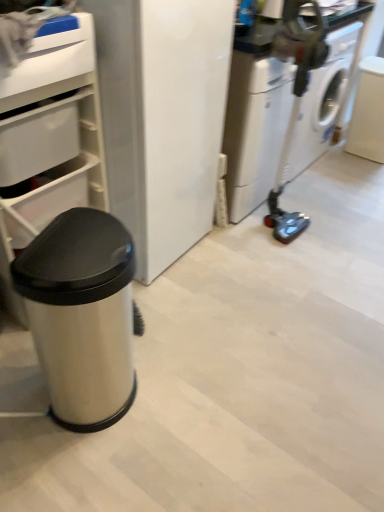
Question: Does white plastic drawer at upper left, positioned as the first drawer in top-to-bottom order, have a lesser height compared to white glossy washing machine at right?

Choices:
 (A) no
 (B) yes

Answer: (B)

Question: Is white plastic drawer at upper left, the second drawer from the bottom, to the left of white glossy washing machine at right from the viewer's perspective?

Choices:
 (A) no
 (B) yes

Answer: (B)

Question: Is white glossy washing machine at right completely or partially inside white plastic drawer at upper left, the second drawer from the bottom?

Choices:
 (A) no
 (B) yes

Answer: (A)

Question: Is white plastic drawer at upper left, the second drawer from the bottom, located outside white glossy washing machine at right?

Choices:
 (A) no
 (B) yes

Answer: (B)

Question: Is white plastic drawer at upper left, positioned as the first drawer in top-to-bottom order, bigger than white glossy washing machine at right?

Choices:
 (A) yes
 (B) no

Answer: (B)

Question: Considering the positions of white plastic drawer at upper left, which is counted as the second drawer, starting from the top, and white glossy washing machine at right in the image, is white plastic drawer at upper left, which is counted as the second drawer, starting from the top, taller or shorter than white glossy washing machine at right?

Choices:
 (A) short
 (B) tall

Answer: (A)

Question: Is white plastic drawer at upper left, which is the first drawer from bottom to top, spatially inside white glossy washing machine at right, or outside of it?

Choices:
 (A) outside
 (B) inside

Answer: (A)

Question: In terms of width, does white plastic drawer at upper left, which is counted as the second drawer, starting from the top, look wider or thinner when compared to white glossy washing machine at right?

Choices:
 (A) wide
 (B) thin

Answer: (A)

Question: From a real-world perspective, is white plastic drawer at upper left, which is counted as the second drawer, starting from the top, above or below white glossy washing machine at right?

Choices:
 (A) below
 (B) above

Answer: (B)

Question: From a real-world perspective, is white plastic drawer at upper left, which is the first drawer from bottom to top, above or below satin silver trash can at left?

Choices:
 (A) below
 (B) above

Answer: (B)

Question: Is white plastic drawer at upper left, which is counted as the second drawer, starting from the top, to the left or to the right of satin silver trash can at left in the image?

Choices:
 (A) right
 (B) left

Answer: (B)

Question: Is white plastic drawer at upper left, which is counted as the second drawer, starting from the top, in front of or behind satin silver trash can at left in the image?

Choices:
 (A) behind
 (B) front

Answer: (A)

Question: Which is correct: white plastic drawer at upper left, which is counted as the second drawer, starting from the top, is inside satin silver trash can at left, or outside of it?

Choices:
 (A) inside
 (B) outside

Answer: (B)

Question: In the image, is white plastic drawer at upper left, the second drawer from the bottom, positioned in front of or behind white glossy washing machine at right?

Choices:
 (A) behind
 (B) front

Answer: (B)

Question: In terms of height, does white plastic drawer at upper left, the second drawer from the bottom, look taller or shorter compared to white glossy washing machine at right?

Choices:
 (A) tall
 (B) short

Answer: (B)